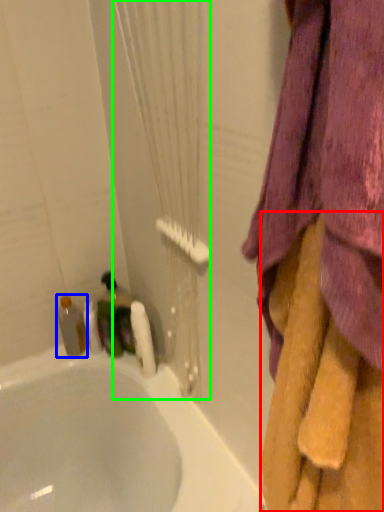
Question: Considering the real-world distances, which object is farthest from towel (highlighted by a red box)? bottle (highlighted by a blue box) or shower curtain (highlighted by a green box)?

Choices:
 (A) bottle
 (B) shower curtain

Answer: (A)